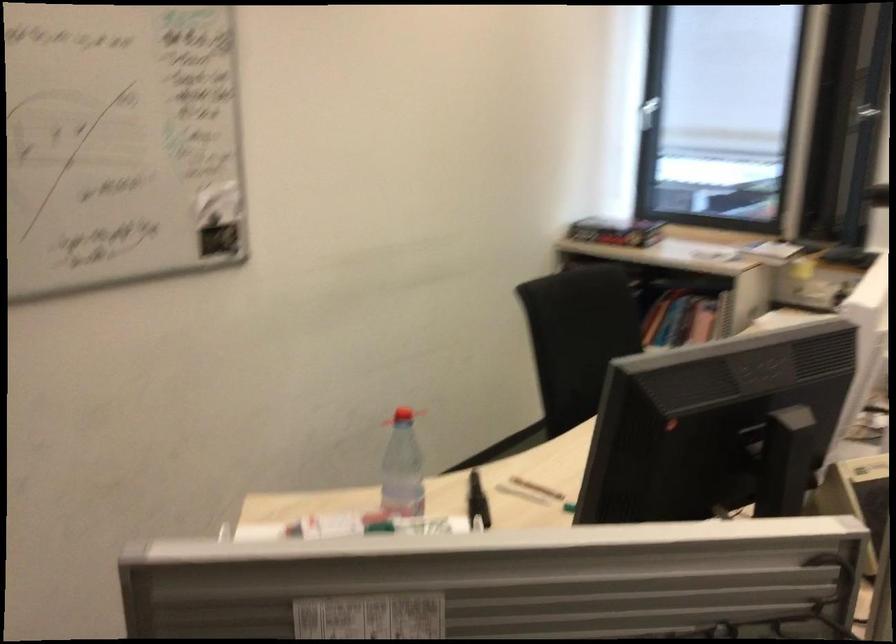
Find where to lift the book in shelf. Please return your answer as a coordinate pair (x, y).

(615, 232)